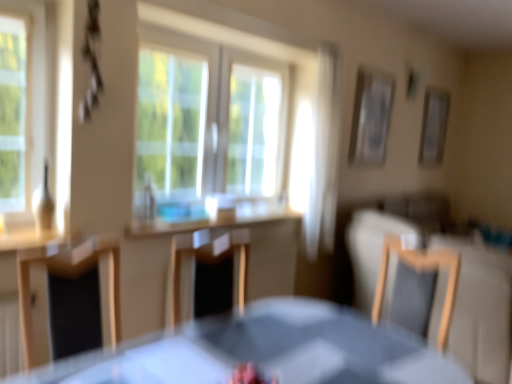
Question: Considering the relative positions of wooden chair at center, the first chair from the left, and white sheer curtain at upper center in the image provided, is wooden chair at center, the first chair from the left, to the left or to the right of white sheer curtain at upper center?

Choices:
 (A) right
 (B) left

Answer: (B)

Question: Is wooden chair at center, the first chair from the left, taller or shorter than white sheer curtain at upper center?

Choices:
 (A) tall
 (B) short

Answer: (B)

Question: Based on their relative distances, which object is nearer to the clear glass window at center?

Choices:
 (A) light brown wooden chair at right, the 1th chair in the right-to-left sequence
 (B) white glossy counter top at center
 (C) smooth gray table at center
 (D) wooden chair at center, the first chair from the left
 (E) white sheer curtain at upper center

Answer: (B)

Question: Which object is the closest to the clear glass window at center?

Choices:
 (A) metallic silver picture frame at upper right, which is the second picture frame in back-to-front order
 (B) smooth gray table at center
 (C) white sheer curtain at upper center
 (D) white glossy counter top at center
 (E) wooden chair at center, the first chair from the left

Answer: (D)